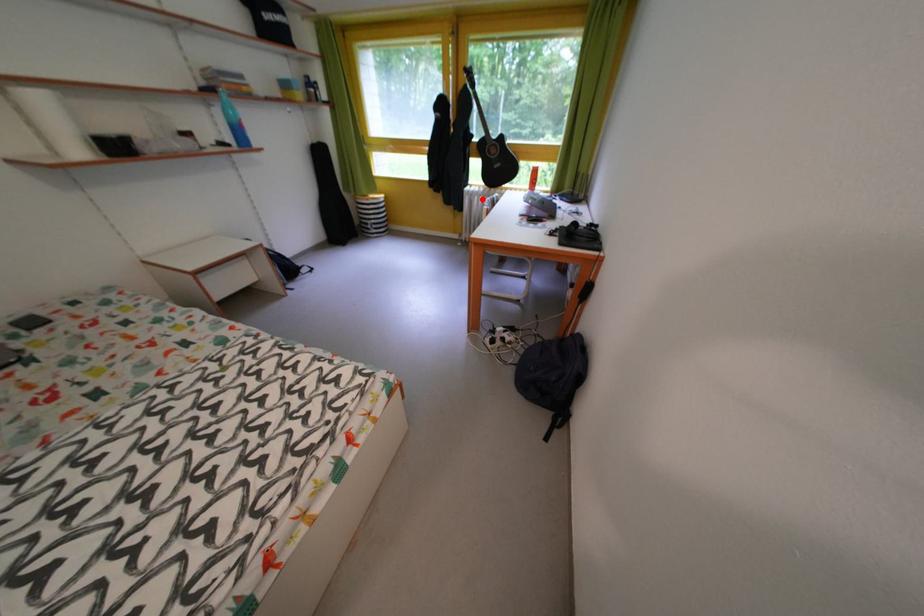
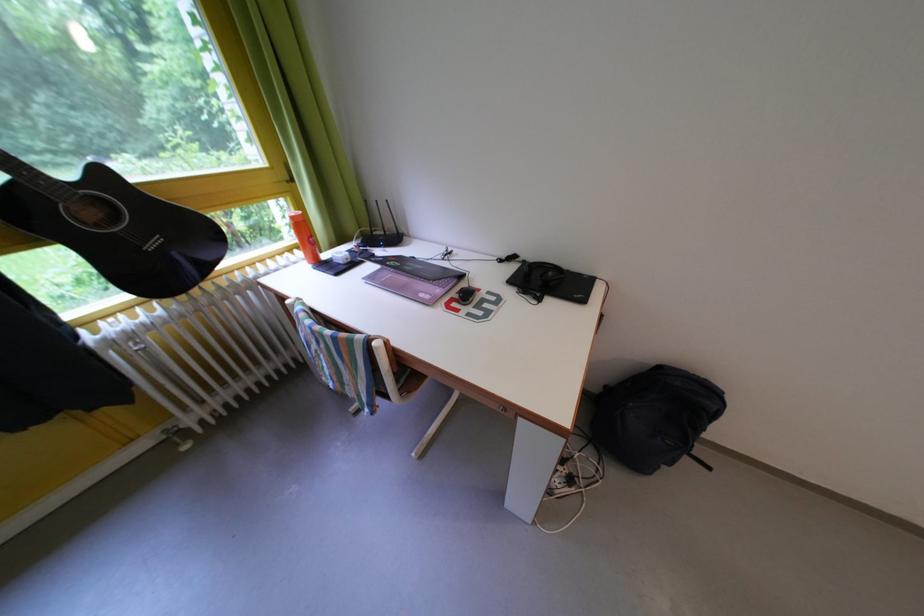
The point at the highlighted location is marked in the first image. Where is the corresponding point in the second image?

(140, 342)